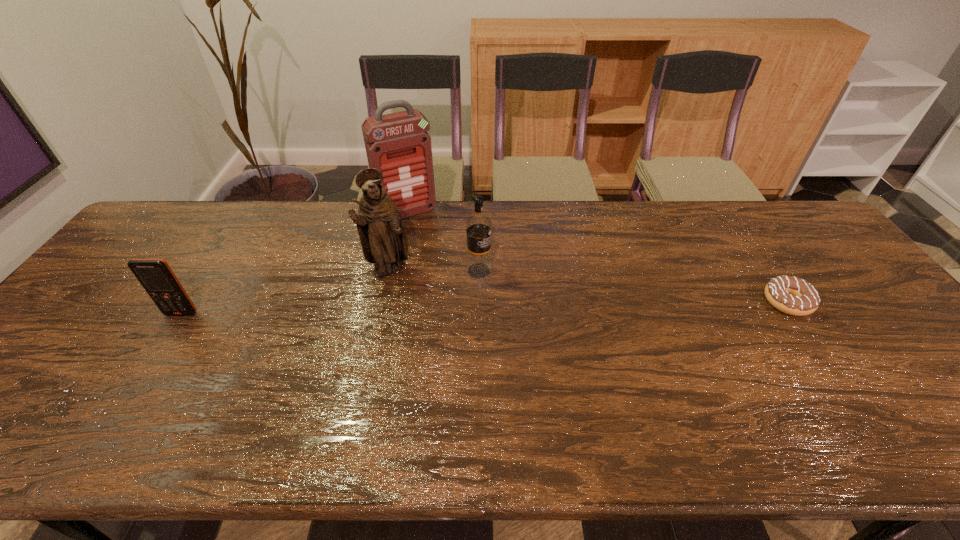
Locate an element on the screen. The height and width of the screenshot is (540, 960). vacant area that lies between the leftmost object and the tallest object is located at coordinates (x=295, y=263).

You are a GUI agent. You are given a task and a screenshot of the screen. Output one action in this format:
    pyautogui.click(x=<x>, y=<y>)
    Task: Click on the empty space between the third tallest object and the shortest object
    The image size is (960, 540).
    Given the screenshot: What is the action you would take?
    [634, 286]

Where is `object that is the closest to the figurine`? The width and height of the screenshot is (960, 540). object that is the closest to the figurine is located at coordinates (397, 144).

Point out which object is positioned as the third nearest to the fourth object from left to right. Please provide its 2D coordinates. Your answer should be formatted as a tuple, i.e. [(x, y)], where the tuple contains the x and y coordinates of a point satisfying the conditions above.

[(155, 275)]

Identify the location of free space that satisfies the following two spatial constraints: 1. on the front side of the fourth object from left to right; 2. on the right side of the first-aid kit. The image size is (960, 540). (396, 271).

Find the location of a particular element. This screenshot has height=540, width=960. vacant space that satisfies the following two spatial constraints: 1. on the front side of the shortest object; 2. on the right side of the farthest object is located at coordinates (390, 302).